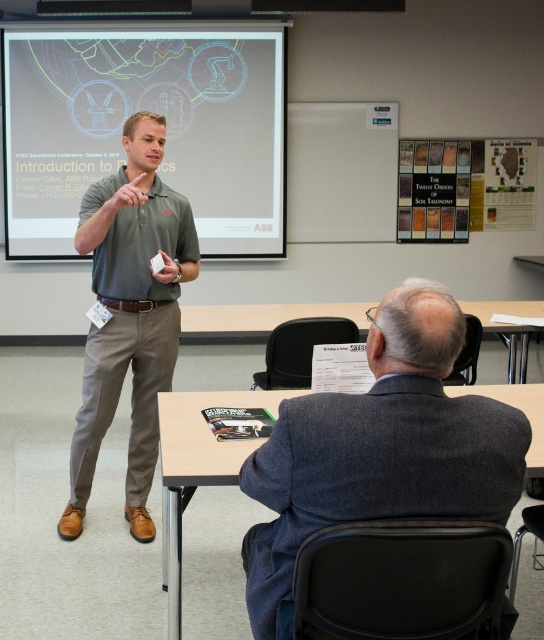
Question: Is dark gray suit at center positioned before matte gray shirt at center?

Choices:
 (A) yes
 (B) no

Answer: (A)

Question: Does matte white projector screen at upper center appear on the left side of dark gray suit at center?

Choices:
 (A) no
 (B) yes

Answer: (B)

Question: Which of the following is the farthest from the observer?

Choices:
 (A) dark gray suit at center
 (B) matte white projector screen at upper center
 (C) matte gray shirt at center

Answer: (B)

Question: Which point is closer to the camera taking this photo?

Choices:
 (A) (313, 518)
 (B) (136, 364)
 (C) (265, 228)

Answer: (A)

Question: Estimate the real-world distances between objects in this image. Which object is farther from the matte gray shirt at center?

Choices:
 (A) matte white projector screen at upper center
 (B) dark gray suit at center

Answer: (A)

Question: Can you confirm if matte white projector screen at upper center is positioned above dark gray suit at center?

Choices:
 (A) no
 (B) yes

Answer: (B)